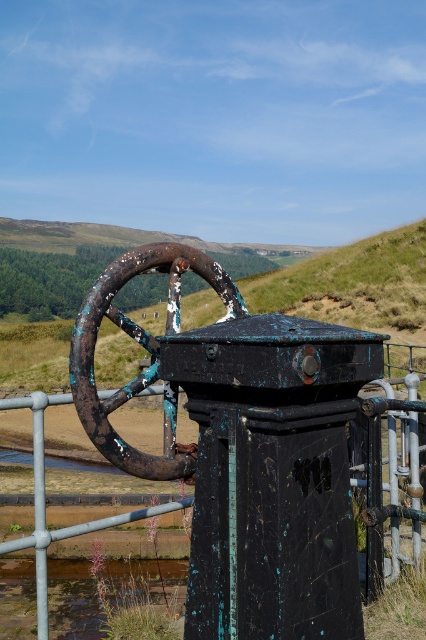
Question: Is rusty metal wheel at center bigger than rusty metal fence at center?

Choices:
 (A) no
 (B) yes

Answer: (A)

Question: Which object is farther from the camera taking this photo?

Choices:
 (A) rusty metal fence at center
 (B) rusty metal wheel at center

Answer: (A)

Question: Can you confirm if rusty metal wheel at center is wider than rusty metal fence at center?

Choices:
 (A) yes
 (B) no

Answer: (B)

Question: Which object appears closest to the camera in this image?

Choices:
 (A) rusty metal wheel at center
 (B) rusty metal fence at center

Answer: (A)

Question: Which point is closer to the camera taking this photo?

Choices:
 (A) (131, 452)
 (B) (36, 442)

Answer: (A)

Question: Is rusty metal wheel at center positioned at the back of rusty metal fence at center?

Choices:
 (A) yes
 (B) no

Answer: (B)